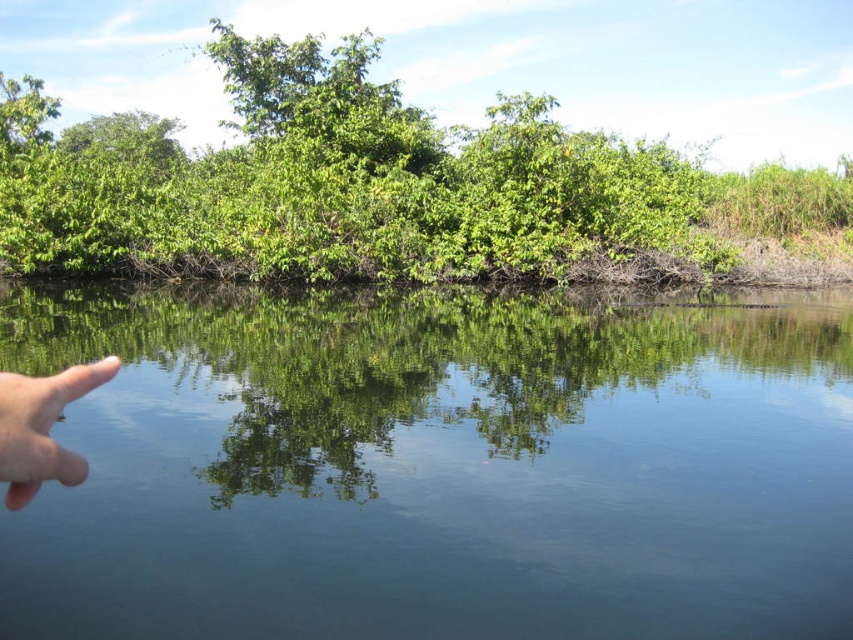
You are an environmental scientist analyzing the image. You need to determine which area covers more space in the scene between the transparent water at center and the green leafy bush at upper center. Based on the scene, which one is larger?

The green leafy bush at upper center is larger because the transparent water at center occupies less space than it.